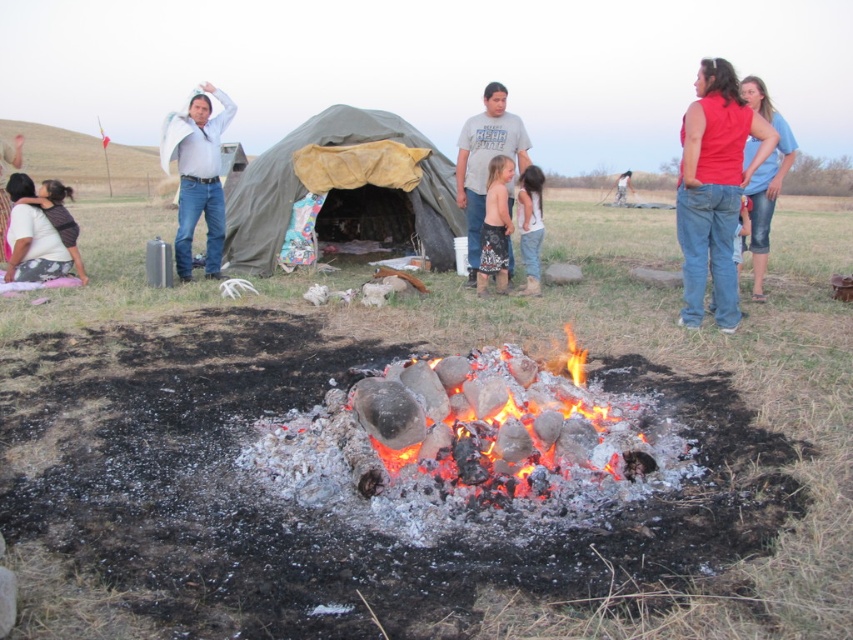
Question: Is dark brown shorts at center to the right of brown leather jacket at center from the viewer's perspective?

Choices:
 (A) yes
 (B) no

Answer: (B)

Question: Observing the image, what is the correct spatial positioning of charcoal logs at center in reference to light blue shirt at upper left?

Choices:
 (A) below
 (B) above

Answer: (A)

Question: Among these points, which one is nearest to the camera?

Choices:
 (A) (618, 186)
 (B) (178, 269)
 (C) (267, 221)
 (D) (495, 93)

Answer: (D)

Question: Based on their relative distances, which object is nearer to the dark brown shorts at center?

Choices:
 (A) charcoal logs at center
 (B) green canvas tent at center
 (C) brown leather jacket at center

Answer: (B)

Question: Can you confirm if red denim jeans at center is positioned above dark brown shorts at center?

Choices:
 (A) no
 (B) yes

Answer: (B)

Question: Which of these objects is positioned closest to the dark brown shorts at center?

Choices:
 (A) denim shorts at right
 (B) charcoal logs at center
 (C) green canvas tent at center
 (D) gray cotton shirt at center

Answer: (D)